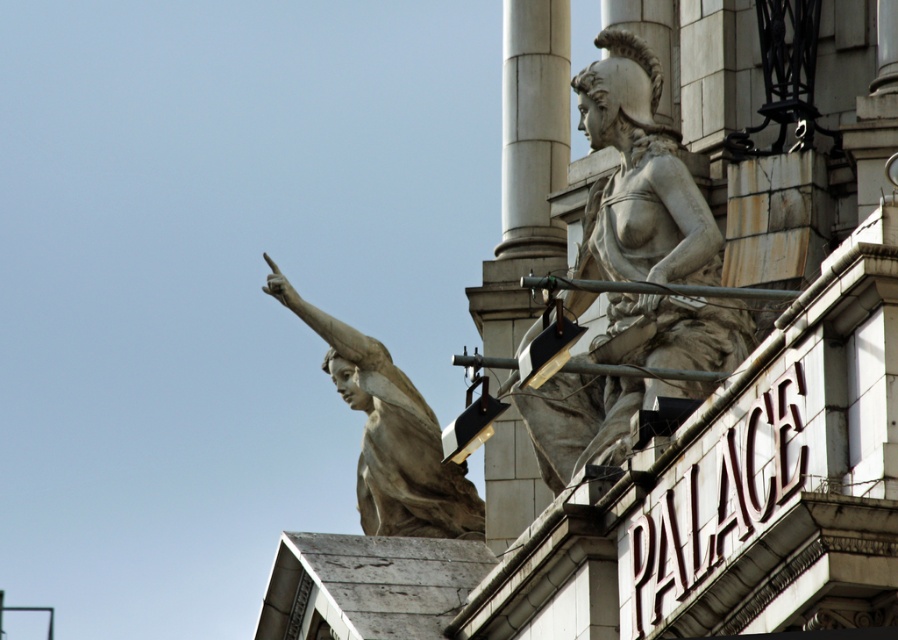
Between white stone pillar at upper right and matte stone statue at upper left, which one is positioned higher?

white stone pillar at upper right is higher up.

Between point (524, 323) and point (386, 380), which one is positioned behind?

The point (386, 380) is behind.

Locate an element on the screen. white stone pillar at upper right is located at coordinates (526, 168).

Does stone statue at upper right appear on the right side of matte stone statue at upper left?

Yes, stone statue at upper right is to the right of matte stone statue at upper left.

Where is `stone statue at upper right`? The image size is (898, 640). stone statue at upper right is located at coordinates (640, 177).

Find the location of a particular element. The width and height of the screenshot is (898, 640). stone statue at upper right is located at coordinates (640, 177).

Between point (659, 236) and point (509, 182), which one is positioned behind?

Point (509, 182)

Is point (603, 97) less distant than point (490, 444)?

That is True.

The width and height of the screenshot is (898, 640). Identify the location of stone statue at upper right. (640, 177).